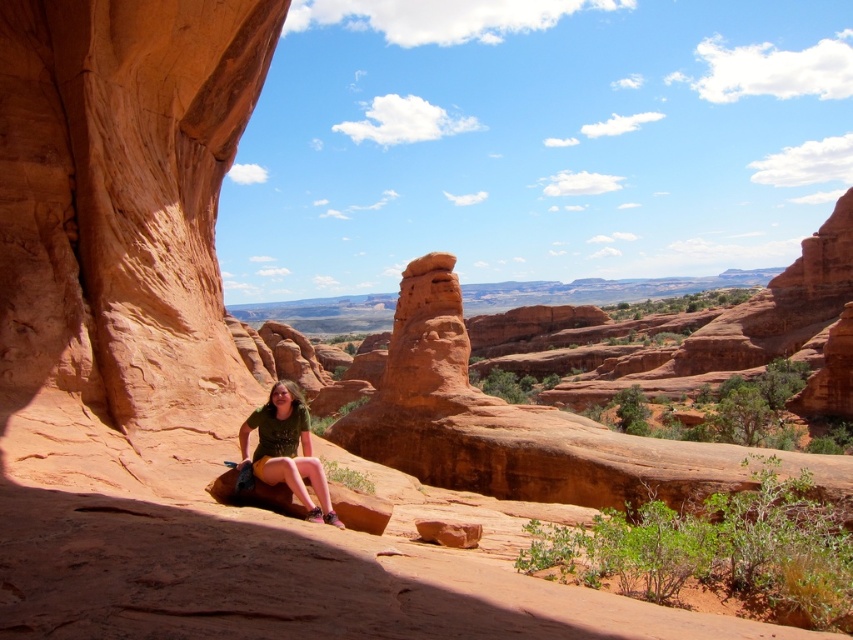
This screenshot has height=640, width=853. I want to click on green matte shorts at lower center, so click(x=286, y=451).

Does green matte shorts at lower center appear over reddish-brown rock at center?

Yes.

Based on the photo, who is more distant from viewer, (x=277, y=433) or (x=460, y=522)?

The point (x=460, y=522) is more distant.

The height and width of the screenshot is (640, 853). I want to click on green matte shorts at lower center, so click(x=286, y=451).